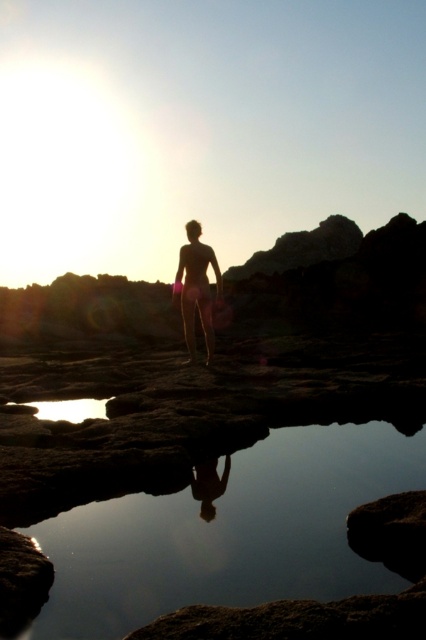
Who is shorter, transparent water at center or silhouette skin at center?

transparent water at center

From the picture: Does transparent water at center have a lesser height compared to silhouette skin at center?

Yes.

Describe the element at coordinates (229, 532) in the screenshot. The width and height of the screenshot is (426, 640). I see `transparent water at center` at that location.

Locate an element on the screen. transparent water at center is located at coordinates (229, 532).

Does transparent water at center have a larger size compared to transparent glass puddle at lower center?

Correct, transparent water at center is larger in size than transparent glass puddle at lower center.

Which is in front, point (175, 577) or point (63, 416)?

Point (175, 577)

Is point (66, 540) positioned after point (75, 419)?

No, (66, 540) is closer to viewer.

Find the location of a particular element. This screenshot has width=426, height=640. transparent water at center is located at coordinates (229, 532).

Between silhouette skin at center and transparent glass puddle at lower center, which one appears on the left side from the viewer's perspective?

transparent glass puddle at lower center is more to the left.

Is silhouette skin at center shorter than transparent glass puddle at lower center?

No, silhouette skin at center is not shorter than transparent glass puddle at lower center.

Does point (187, 340) lie behind point (112, 397)?

Yes, point (187, 340) is behind point (112, 397).

At what (x,y) coordinates should I click in order to perform the action: click on silhouette skin at center. Please return your answer as a coordinate pair (x, y). This screenshot has width=426, height=640. Looking at the image, I should click on (196, 289).